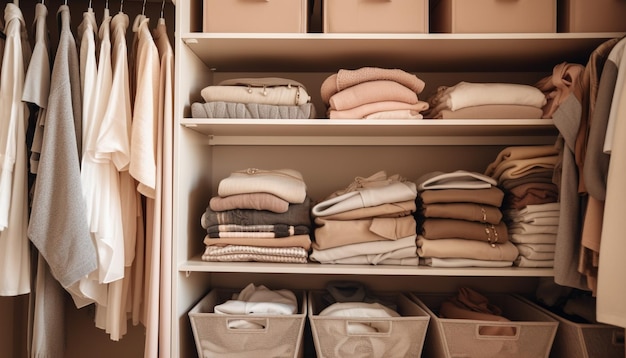
Where is `baskets on top shelf`? This screenshot has height=358, width=626. baskets on top shelf is located at coordinates (238, 7), (351, 11), (491, 12), (583, 8).